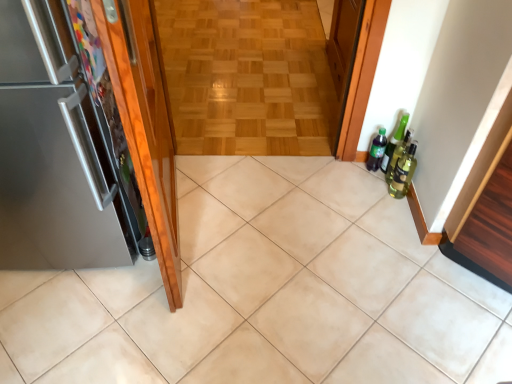
Image resolution: width=512 pixels, height=384 pixels. I want to click on free space that is in between shiny wood door at left, arranged as the first door when viewed from the right, and green glass bottle at right, the 1th beer bottle viewed from the front, so click(x=274, y=214).